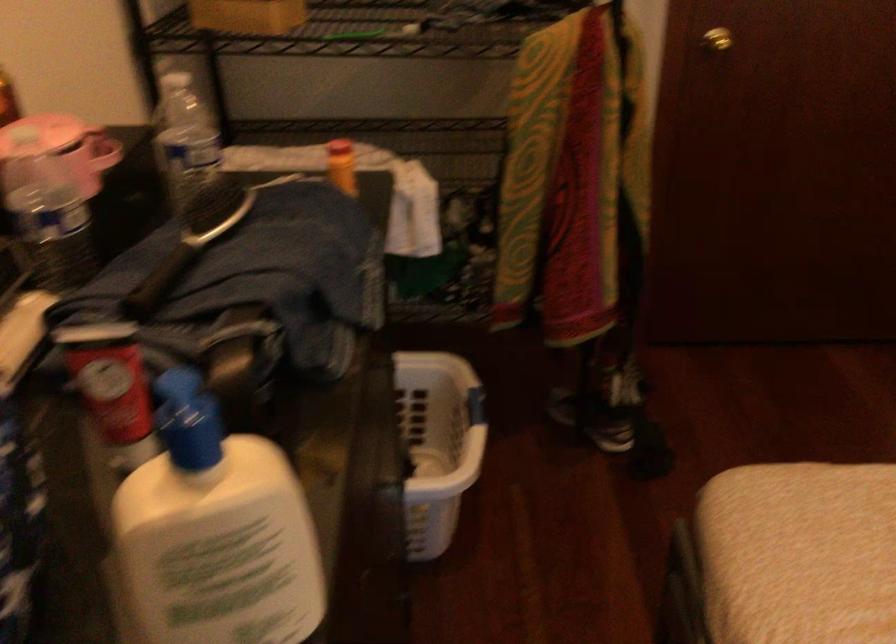
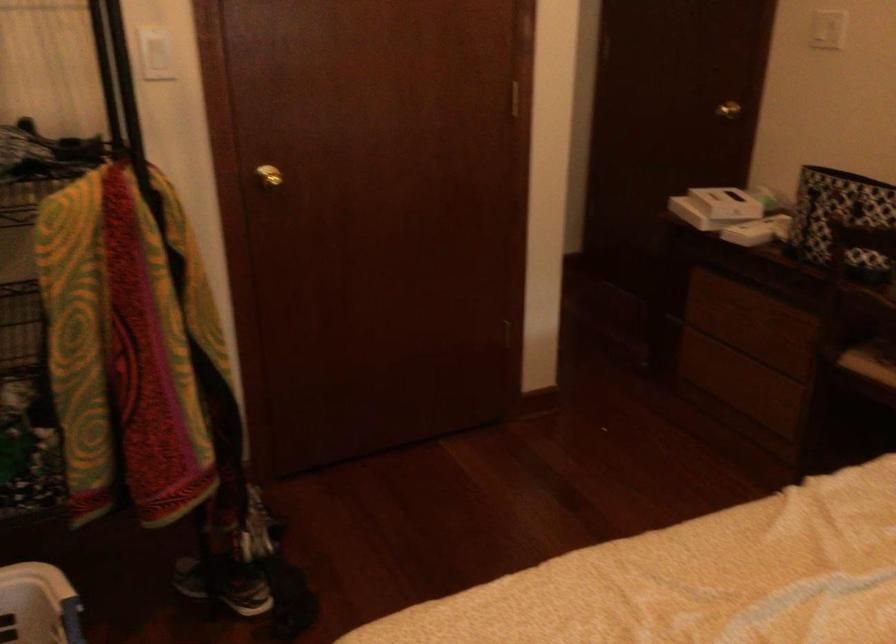
Where in the second image is the point corresponding to [469,402] from the first image?

(63, 616)